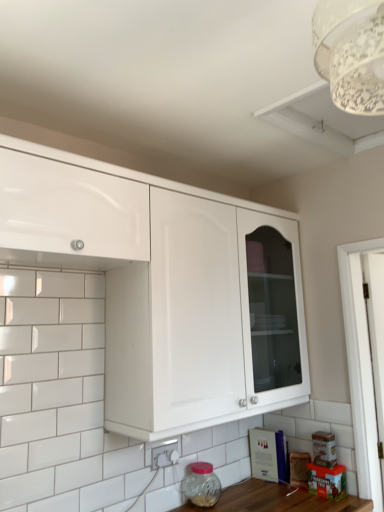
The width and height of the screenshot is (384, 512). Describe the element at coordinates (202, 485) in the screenshot. I see `transparent glass jar at lower center` at that location.

What do you see at coordinates (351, 53) in the screenshot? The width and height of the screenshot is (384, 512). I see `white lace lampshade at upper right` at bounding box center [351, 53].

The height and width of the screenshot is (512, 384). What do you see at coordinates (164, 287) in the screenshot?
I see `white glossy cabinet at upper center, placed as the second cabinetry when sorted from left to right` at bounding box center [164, 287].

The height and width of the screenshot is (512, 384). Identify the location of white glossy electric outlet at lower center. (164, 454).

The image size is (384, 512). Find the location of `transparent glass jar at lower center`. transparent glass jar at lower center is located at coordinates (202, 485).

Would you consider white glossy cabinet at upper left, acting as the 2th cabinetry starting from the right, to be distant from white lace lampshade at upper right?

white glossy cabinet at upper left, acting as the 2th cabinetry starting from the right, is actually quite close to white lace lampshade at upper right.

Does white glossy cabinet at upper left, acting as the 2th cabinetry starting from the right, have a smaller size compared to white lace lampshade at upper right?

No.

Is white lace lampshade at upper right inside white glossy cabinet at upper left, the first cabinetry positioned from the left?

Definitely not — white lace lampshade at upper right is not inside white glossy cabinet at upper left, the first cabinetry positioned from the left.

Find the location of a particular element. This screenshot has height=512, width=384. cabinetry that is the 1st one below the white lace lampshade at upper right (from a real-world perspective) is located at coordinates (69, 215).

Is white glossy cabinet at upper left, the first cabinetry positioned from the left, surrounded by white glossy cabinet at upper center, placed as the second cabinetry when sorted from left to right?

No.

Can you tell me how much white glossy cabinet at upper center, which appears as the first cabinetry when viewed from the right, and white glossy cabinet at upper left, the first cabinetry positioned from the left, differ in facing direction?

They differ by 0.000271 degrees in their facing directions.

From the image's perspective, who appears lower, white glossy cabinet at upper center, placed as the second cabinetry when sorted from left to right, or white glossy cabinet at upper left, acting as the 2th cabinetry starting from the right?

white glossy cabinet at upper center, placed as the second cabinetry when sorted from left to right, from the image's perspective.

Which is closer, (230, 412) or (101, 246)?

Point (230, 412) appears to be farther away from the viewer than point (101, 246).

I want to click on cabinetry directly beneath the white glossy cabinet at upper left, acting as the 2th cabinetry starting from the right (from a real-world perspective), so click(x=164, y=287).

Looking at this image, considering the relative sizes of white glossy cabinet at upper left, acting as the 2th cabinetry starting from the right, and white glossy cabinet at upper center, placed as the second cabinetry when sorted from left to right, in the image provided, is white glossy cabinet at upper left, acting as the 2th cabinetry starting from the right, thinner than white glossy cabinet at upper center, placed as the second cabinetry when sorted from left to right,?

Correct, the width of white glossy cabinet at upper left, acting as the 2th cabinetry starting from the right, is less than that of white glossy cabinet at upper center, placed as the second cabinetry when sorted from left to right.

Is the depth of white glossy cabinet at upper left, the first cabinetry positioned from the left, less than that of white glossy cabinet at upper center, which appears as the first cabinetry when viewed from the right?

Yes, it is in front of white glossy cabinet at upper center, which appears as the first cabinetry when viewed from the right.

Based on their sizes in the image, would you say white glossy cabinet at upper left, acting as the 2th cabinetry starting from the right, is bigger or smaller than white glossy cabinet at upper center, placed as the second cabinetry when sorted from left to right?

In the image, white glossy cabinet at upper left, acting as the 2th cabinetry starting from the right, appears to be smaller than white glossy cabinet at upper center, placed as the second cabinetry when sorted from left to right.

Are white glossy electric outlet at lower center and white glossy cabinet at upper left, acting as the 2th cabinetry starting from the right, located far from each other?

white glossy electric outlet at lower center is positioned a significant distance from white glossy cabinet at upper left, acting as the 2th cabinetry starting from the right.

Who is taller, white glossy electric outlet at lower center or white glossy cabinet at upper left, the first cabinetry positioned from the left?

With more height is white glossy cabinet at upper left, the first cabinetry positioned from the left.

Does white glossy electric outlet at lower center have a larger size compared to white glossy cabinet at upper left, the first cabinetry positioned from the left?

No.

Between white glossy cabinet at upper left, the first cabinetry positioned from the left, and white glossy electric outlet at lower center, which one appears on the right side from the viewer's perspective?

From the viewer's perspective, white glossy electric outlet at lower center appears more on the right side.

From the picture: Looking at their sizes, would you say white glossy cabinet at upper left, the first cabinetry positioned from the left, is wider or thinner than white glossy electric outlet at lower center?

Clearly, white glossy cabinet at upper left, the first cabinetry positioned from the left, has more width compared to white glossy electric outlet at lower center.

Looking at this image, what's the angular difference between white glossy cabinet at upper left, acting as the 2th cabinetry starting from the right, and white glossy electric outlet at lower center's facing directions?

The angular difference between white glossy cabinet at upper left, acting as the 2th cabinetry starting from the right, and white glossy electric outlet at lower center is 2.2 degrees.

Considering the relative positions of transparent glass jar at lower center and white lace lampshade at upper right in the image provided, is transparent glass jar at lower center to the left of white lace lampshade at upper right from the viewer's perspective?

A: Yes.

Which of these two, transparent glass jar at lower center or white lace lampshade at upper right, stands taller?

white lace lampshade at upper right is taller.

Is the position of transparent glass jar at lower center more distant than that of white lace lampshade at upper right?

Yes.

Is white glossy cabinet at upper center, which appears as the first cabinetry when viewed from the right, positioned with its back to transparent glass jar at lower center?

white glossy cabinet at upper center, which appears as the first cabinetry when viewed from the right, is not turned away from transparent glass jar at lower center.

Does white glossy cabinet at upper center, which appears as the first cabinetry when viewed from the right, touch transparent glass jar at lower center?

No, white glossy cabinet at upper center, which appears as the first cabinetry when viewed from the right, is not next to transparent glass jar at lower center.

From the image's perspective, who appears lower, white glossy cabinet at upper center, placed as the second cabinetry when sorted from left to right, or transparent glass jar at lower center?

transparent glass jar at lower center, from the image's perspective.

The height and width of the screenshot is (512, 384). What are the coordinates of `appliance on the left of white glossy cabinet at upper center, placed as the second cabinetry when sorted from left to right` in the screenshot? It's located at (202, 485).

The height and width of the screenshot is (512, 384). Find the location of `light fixture in front of the white glossy cabinet at upper left, acting as the 2th cabinetry starting from the right`. light fixture in front of the white glossy cabinet at upper left, acting as the 2th cabinetry starting from the right is located at coordinates (351, 53).

Locate an element on the screen. The height and width of the screenshot is (512, 384). cabinetry below the white glossy cabinet at upper left, acting as the 2th cabinetry starting from the right (from the image's perspective) is located at coordinates (164, 287).

Considering their positions, is white glossy cabinet at upper left, acting as the 2th cabinetry starting from the right, positioned further to white glossy cabinet at upper center, placed as the second cabinetry when sorted from left to right, than white lace lampshade at upper right?

Based on the image, white lace lampshade at upper right appears to be further to white glossy cabinet at upper center, placed as the second cabinetry when sorted from left to right.

Estimate the real-world distances between objects in this image. Which object is further from white glossy electric outlet at lower center, white glossy cabinet at upper left, acting as the 2th cabinetry starting from the right, or white glossy cabinet at upper center, placed as the second cabinetry when sorted from left to right?

white glossy cabinet at upper left, acting as the 2th cabinetry starting from the right, lies further to white glossy electric outlet at lower center than the other object.

Considering their positions, is transparent glass jar at lower center positioned further to white lace lampshade at upper right than white glossy cabinet at upper center, placed as the second cabinetry when sorted from left to right?

The object further to white lace lampshade at upper right is transparent glass jar at lower center.

When comparing their distances from white glossy cabinet at upper center, which appears as the first cabinetry when viewed from the right, does transparent glass jar at lower center or white glossy electric outlet at lower center seem closer?

white glossy electric outlet at lower center is positioned closer to the anchor white glossy cabinet at upper center, which appears as the first cabinetry when viewed from the right.

Considering their positions, is white lace lampshade at upper right positioned closer to white glossy cabinet at upper center, placed as the second cabinetry when sorted from left to right, than transparent glass jar at lower center?

transparent glass jar at lower center lies closer to white glossy cabinet at upper center, placed as the second cabinetry when sorted from left to right, than the other object.

Estimate the real-world distances between objects in this image. Which object is further from transparent glass jar at lower center, white glossy electric outlet at lower center or white glossy cabinet at upper center, which appears as the first cabinetry when viewed from the right?

Among the two, white glossy cabinet at upper center, which appears as the first cabinetry when viewed from the right, is located further to transparent glass jar at lower center.

Looking at this image, considering their positions, is white glossy cabinet at upper left, the first cabinetry positioned from the left, positioned further to white lace lampshade at upper right than transparent glass jar at lower center?

transparent glass jar at lower center is further to white lace lampshade at upper right.

Based on the photo, based on their spatial positions, is transparent glass jar at lower center or white glossy electric outlet at lower center closer to white glossy cabinet at upper left, acting as the 2th cabinetry starting from the right?

Among the two, white glossy electric outlet at lower center is located nearer to white glossy cabinet at upper left, acting as the 2th cabinetry starting from the right.

The width and height of the screenshot is (384, 512). Find the location of `cabinetry between white glossy cabinet at upper left, the first cabinetry positioned from the left, and white glossy electric outlet at lower center, in the vertical direction`. cabinetry between white glossy cabinet at upper left, the first cabinetry positioned from the left, and white glossy electric outlet at lower center, in the vertical direction is located at coordinates (164, 287).

Identify the location of electric outlet between white glossy cabinet at upper left, the first cabinetry positioned from the left, and transparent glass jar at lower center vertically. The height and width of the screenshot is (512, 384). (164, 454).

Identify the location of electric outlet between white glossy cabinet at upper center, which appears as the first cabinetry when viewed from the right, and transparent glass jar at lower center, in the vertical direction. This screenshot has width=384, height=512. (164, 454).

Where is `cabinetry between white glossy cabinet at upper left, acting as the 2th cabinetry starting from the right, and white lace lampshade at upper right`? cabinetry between white glossy cabinet at upper left, acting as the 2th cabinetry starting from the right, and white lace lampshade at upper right is located at coordinates (164, 287).